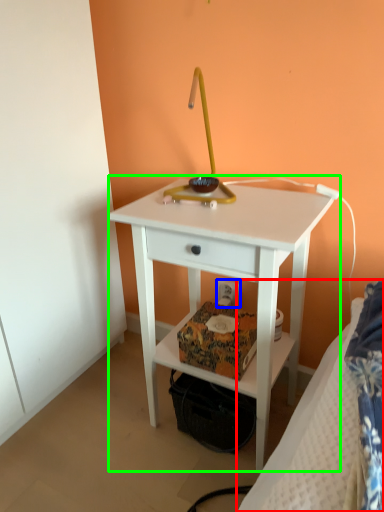
Question: Considering the real-world distances, which object is farthest from bed (highlighted by a red box)? electric outlet (highlighted by a blue box) or nightstand (highlighted by a green box)?

Choices:
 (A) electric outlet
 (B) nightstand

Answer: (A)